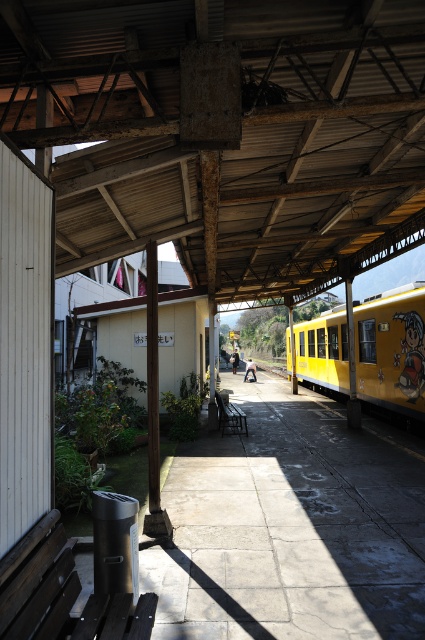
Question: Which object appears closest to the camera in this image?

Choices:
 (A) dark brown wooden bench at lower left
 (B) yellow matte train at right
 (C) wooden bench at center

Answer: (A)

Question: Is dark brown wooden bench at lower left closer to camera compared to wooden bench at center?

Choices:
 (A) no
 (B) yes

Answer: (B)

Question: Estimate the real-world distances between objects in this image. Which object is closer to the wooden bench at center?

Choices:
 (A) yellow matte train at right
 (B) dark brown wooden bench at lower left

Answer: (A)

Question: Does yellow matte train at right have a lesser width compared to wooden bench at center?

Choices:
 (A) no
 (B) yes

Answer: (A)

Question: Can you confirm if yellow matte train at right is wider than dark brown wooden bench at lower left?

Choices:
 (A) no
 (B) yes

Answer: (B)

Question: Among these points, which one is farthest from the camera?

Choices:
 (A) (360, 344)
 (B) (59, 595)

Answer: (A)